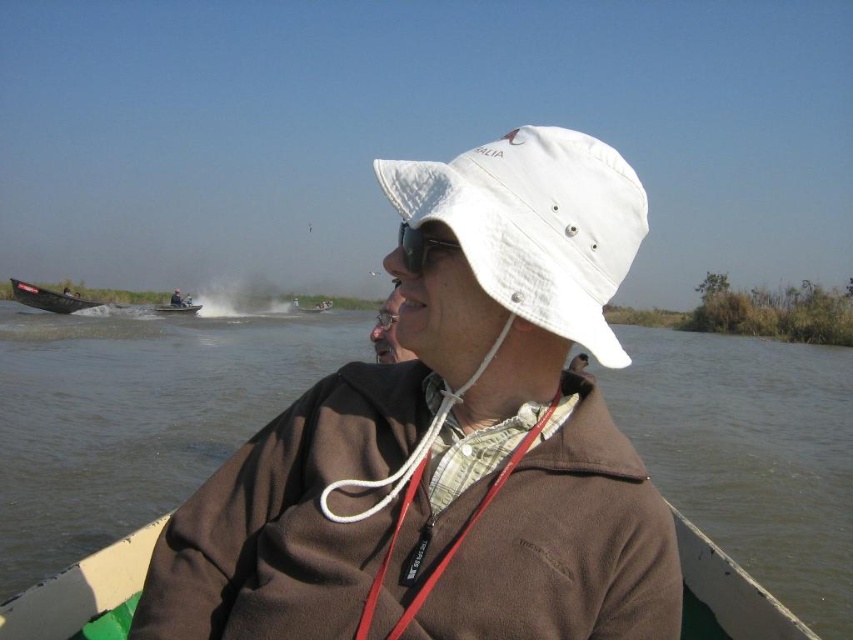
You are a photographer trying to capture a clear shot of the matte black goggles at center and the metallic gray boat at left. Based on their sizes in the image, which object would appear smaller in your photo?

The matte black goggles at center would appear smaller in the photo since they occupy less space than the metallic gray boat at left.

You are standing at the point marked as point (x=428, y=240). You want to throw a ball to your friend who is 1.74 meters away from you. What is the minimum distance you need to throw the ball?

The minimum distance you need to throw the ball is 1.74 meters because your friend is exactly 1.74 meters away from point (x=428, y=240).

Looking at this image, you are a photographer trying to capture the scene from the boat. You notice a point marked at coordinates (419, 244). What object is located at that point?

The point at (419, 244) marks matte black goggles at center.